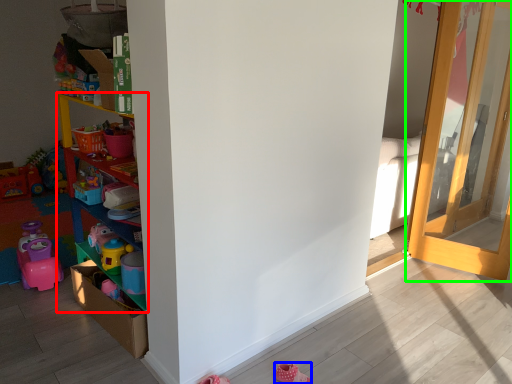
Question: Considering the real-world distances, which object is closest to shelf (highlighted by a red box)? shoe (highlighted by a blue box) or door (highlighted by a green box).

Choices:
 (A) shoe
 (B) door

Answer: (A)